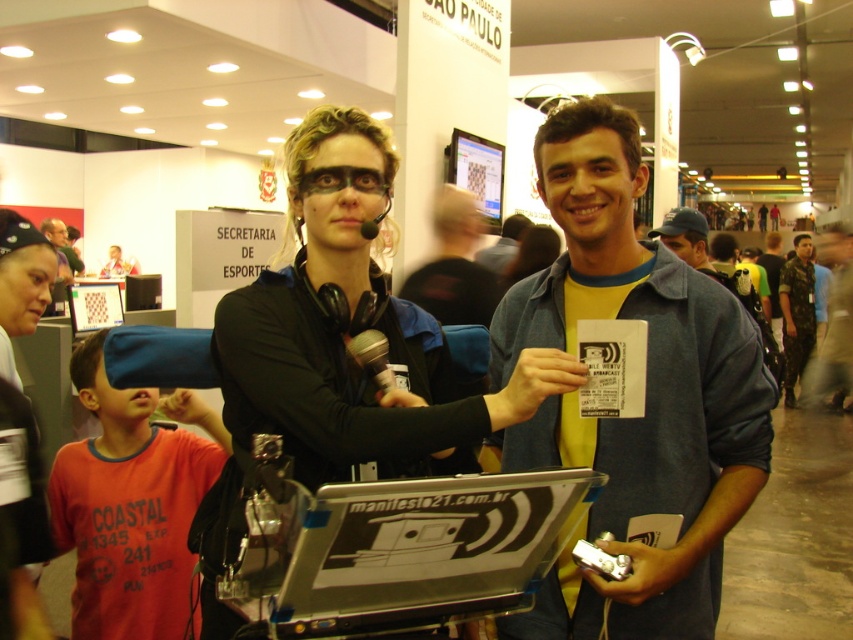
Does red t-shirt at center appear over camouflage fabric shirt at right?

Incorrect, red t-shirt at center is not positioned above camouflage fabric shirt at right.

Is red t-shirt at center shorter than camouflage fabric shirt at right?

Indeed, red t-shirt at center has a lesser height compared to camouflage fabric shirt at right.

What do you see at coordinates (131, 502) in the screenshot? I see `red t-shirt at center` at bounding box center [131, 502].

You are a GUI agent. You are given a task and a screenshot of the screen. Output one action in this format:
    pyautogui.click(x=<x>, y=<y>)
    Task: Click on the red t-shirt at center
    
    Given the screenshot: What is the action you would take?
    pyautogui.click(x=131, y=502)

Between blue denim jacket at center and camouflage fabric shirt at right, which one appears on the left side from the viewer's perspective?

blue denim jacket at center is more to the left.

The image size is (853, 640). What do you see at coordinates (454, 266) in the screenshot?
I see `blue denim jacket at center` at bounding box center [454, 266].

At what (x,y) coordinates should I click in order to perform the action: click on blue denim jacket at center. Please return your answer as a coordinate pair (x, y). The width and height of the screenshot is (853, 640). Looking at the image, I should click on [454, 266].

Does point (450, 301) come farther from viewer compared to point (395, 403)?

Yes, point (450, 301) is behind point (395, 403).

From the picture: Can you confirm if blue denim jacket at center is thinner than silver metallic microphone at center?

No, blue denim jacket at center is not thinner than silver metallic microphone at center.

Does point (433, 296) come farther from viewer compared to point (381, 346)?

Yes, it is.

Where is `blue denim jacket at center`? blue denim jacket at center is located at coordinates (454, 266).